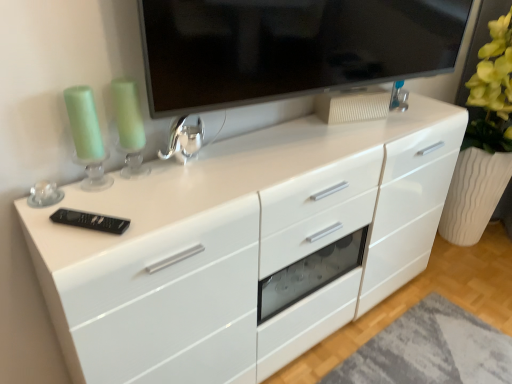
Locate an element on the screen. Image resolution: width=512 pixels, height=384 pixels. vacant point to the right of shiny metallic faucet at center, which appears as the 2th appliance when viewed from the left is located at coordinates (233, 167).